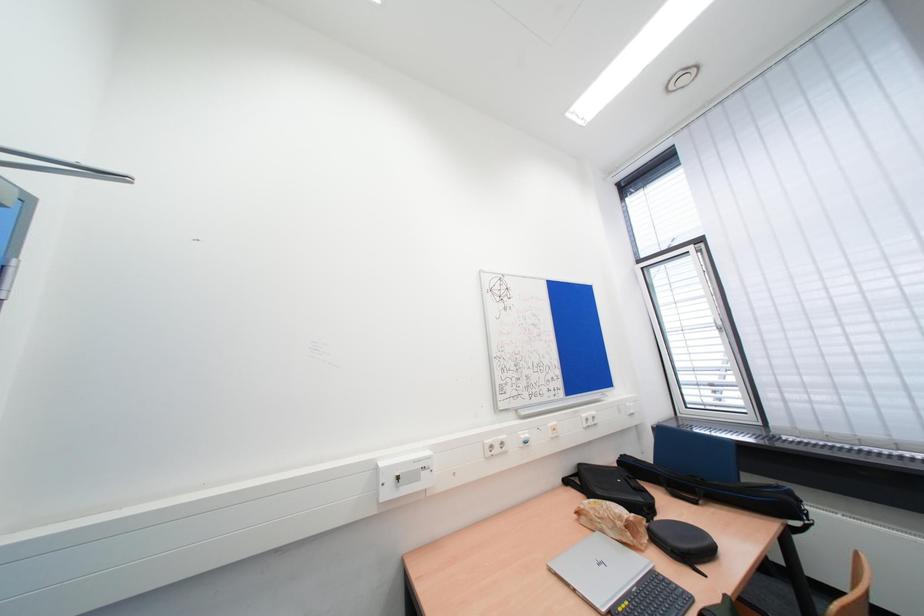
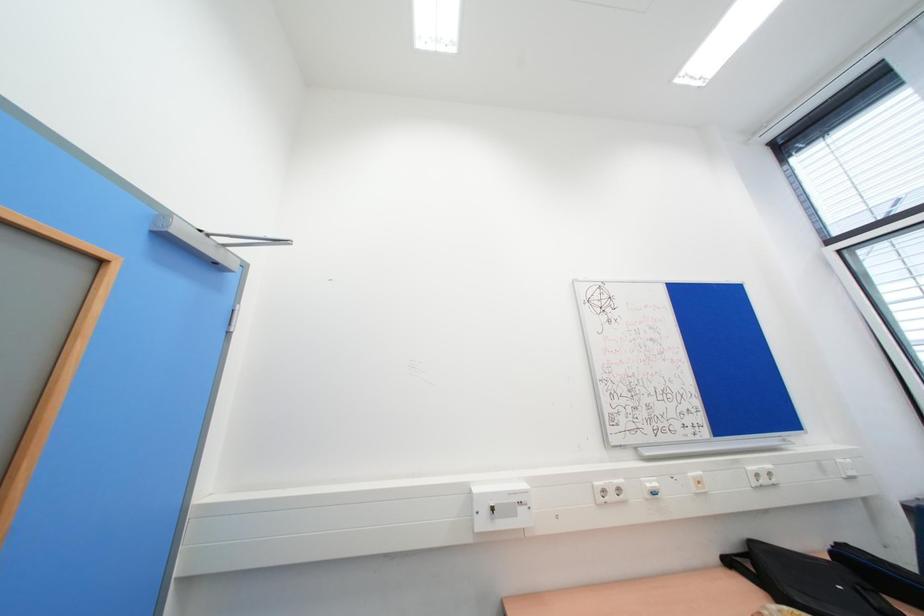
Question: The camera is either moving clockwise (left) or counter-clockwise (right) around the object. The first image is from the beginning of the video and the second image is from the end. Is the camera moving left or right when shooting the video?

Choices:
 (A) Left
 (B) Right

Answer: (B)